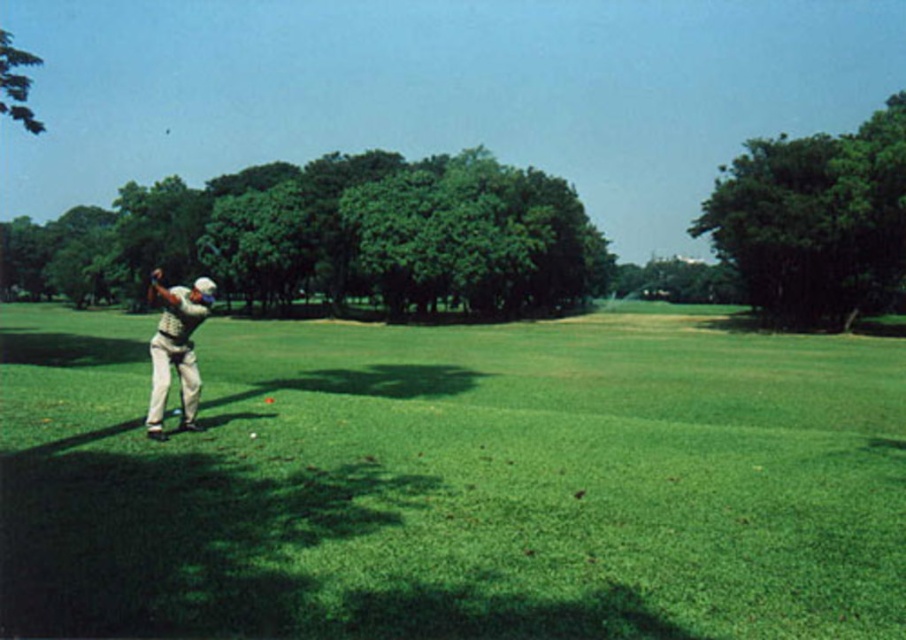
You are standing at the point with coordinates point (149, 426) and want to walk towards the point with coordinates point (613, 570). Which direction should you face to walk directly towards your destination?

You should face towards the direction of point (613, 570) because it is in front of point (149, 426).

You are standing at point (453, 483) on the golf course. What is the color of the ground directly beneath your feet?

The ground at point (453, 483) is green grass at left, so the color is green.